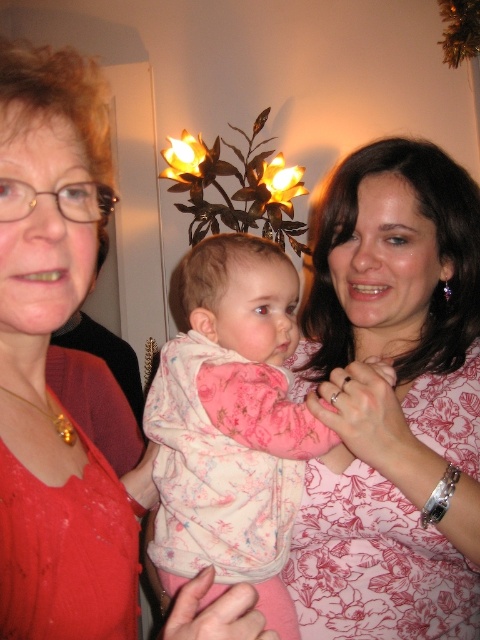
Looking at this image, you are a photographer trying to capture the baby in the center. Which clothing item, the floral pink blouse at center or the fluffy pink pajamas at center, would be easier to focus on due to its size?

The floral pink blouse at center has a larger size compared to the fluffy pink pajamas at center, so it would be easier to focus on the floral pink blouse at center because of its larger size.

You are standing in the room and see the floral pink blouse at center and the pink floral dress at center. Which one is closer to you?

The floral pink blouse at center is closer to you because it is further to the viewer than the pink floral dress at center.

You are a photographer trying to capture a closeup of the baby in the center. The baby is wearing two items of clothing. Which item is taller, the pink floral dress at center or the fluffy pink pajamas at center?

The pink floral dress at center is much taller as fluffy pink pajamas at center, so the pink floral dress at center is the taller item.